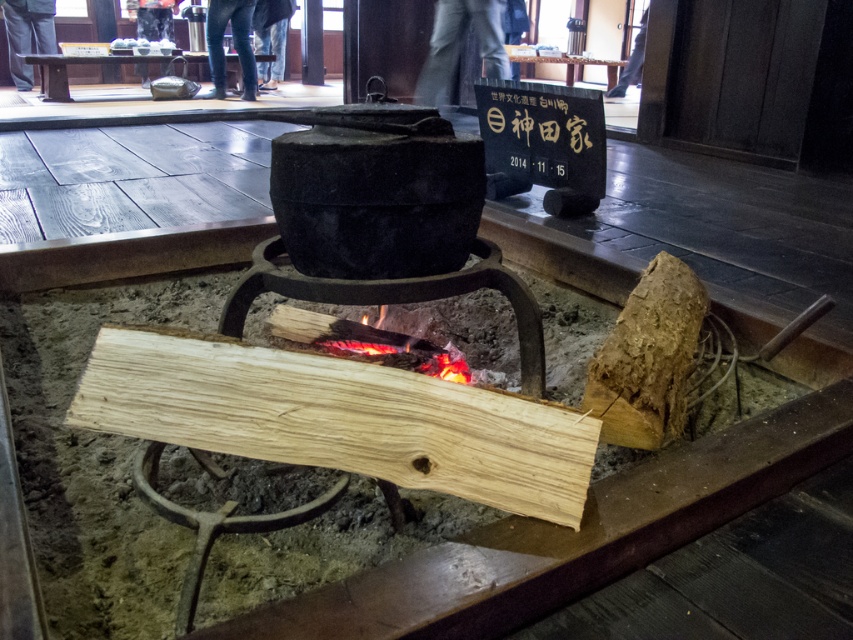
Question: Is light brown wood at center in front of charcoal fire at center?

Choices:
 (A) no
 (B) yes

Answer: (B)

Question: Does light brown wood at center have a larger size compared to charcoal fire at center?

Choices:
 (A) yes
 (B) no

Answer: (B)

Question: In this image, where is light brown wood at center located relative to charcoal fire at center?

Choices:
 (A) right
 (B) left

Answer: (B)